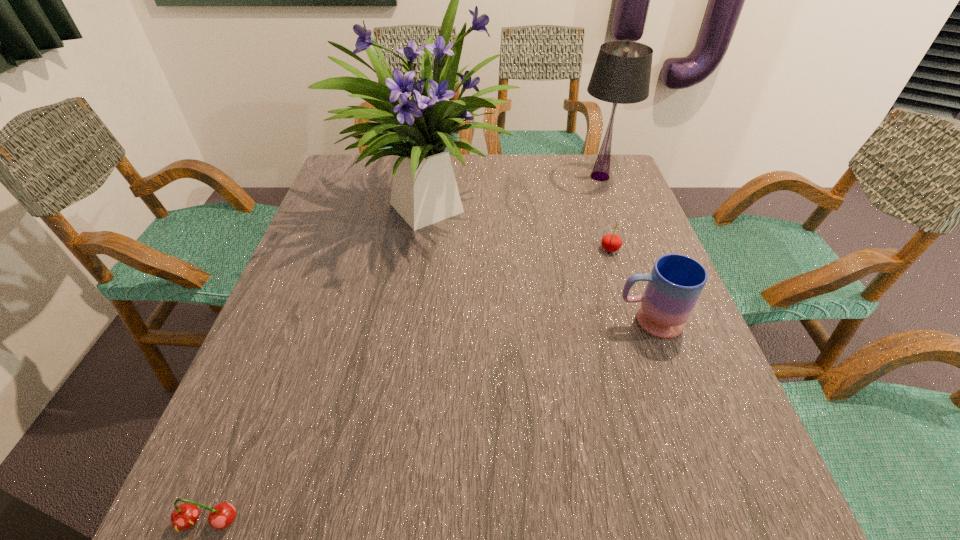
The image size is (960, 540). In order to click on free spot located 0.370m on the front-facing side of the fourth shortest object in this screenshot , I will do `click(451, 177)`.

This screenshot has width=960, height=540. Identify the location of free space located 0.380m on the side of the fourth farthest object with the handle. (433, 321).

In order to click on vacant region located 0.050m on the side of the fourth farthest object with the handle in this screenshot , I will do `click(590, 321)`.

Find the location of a particular element. The width and height of the screenshot is (960, 540). vacant space located 0.060m on the side of the fourth farthest object with the handle is located at coordinates (586, 321).

Where is `vacant region located 0.150m on the back of the farther cherry`? Image resolution: width=960 pixels, height=540 pixels. vacant region located 0.150m on the back of the farther cherry is located at coordinates (597, 208).

Where is `flower arrangement present at the far edge`? Image resolution: width=960 pixels, height=540 pixels. flower arrangement present at the far edge is located at coordinates (424, 191).

Find the location of `lampshade at the far edge`. lampshade at the far edge is located at coordinates 621,75.

The height and width of the screenshot is (540, 960). In order to click on object at the near edge in this screenshot , I will do `click(184, 516)`.

At what (x,y) coordinates should I click in order to perform the action: click on flower arrangement that is at the left edge. Please return your answer as a coordinate pair (x, y). This screenshot has width=960, height=540. Looking at the image, I should click on (424, 191).

The image size is (960, 540). I want to click on cherry that is at the left edge, so click(184, 516).